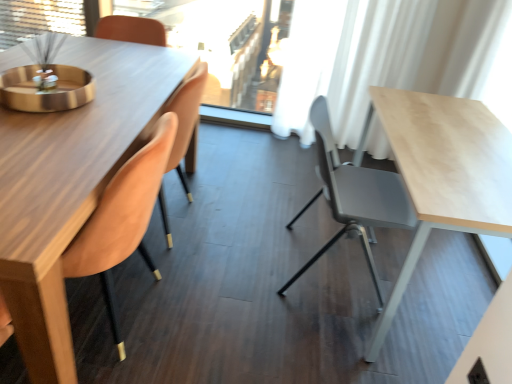
Identify the location of free point below matte gray chair at center, the 2th chair positioned from the left (from a real-world perspective). The width and height of the screenshot is (512, 384). (343, 268).